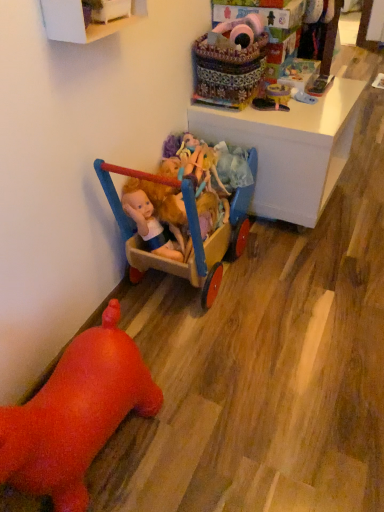
Where is `free region on the left part of black rubber shoe at upper right, which is the 4th toy from bottom to top`? The width and height of the screenshot is (384, 512). free region on the left part of black rubber shoe at upper right, which is the 4th toy from bottom to top is located at coordinates 242,112.